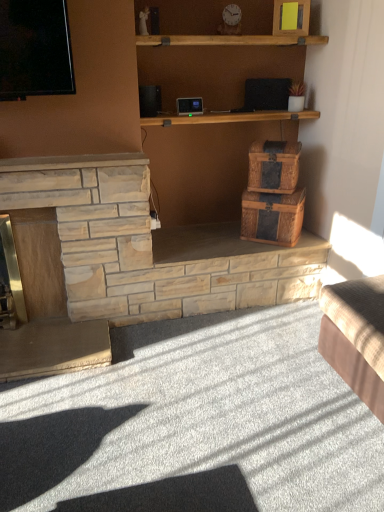
Question: Is woven wood chest at center outside natural stone fireplace at left?

Choices:
 (A) yes
 (B) no

Answer: (A)

Question: Considering the relative sizes of woven wood chest at center and natural stone fireplace at left in the image provided, is woven wood chest at center thinner than natural stone fireplace at left?

Choices:
 (A) yes
 (B) no

Answer: (B)

Question: Can you confirm if woven wood chest at center is wider than natural stone fireplace at left?

Choices:
 (A) no
 (B) yes

Answer: (B)

Question: Can you confirm if woven wood chest at center is positioned to the right of natural stone fireplace at left?

Choices:
 (A) no
 (B) yes

Answer: (B)

Question: Is woven wood chest at center closer to the viewer compared to natural stone fireplace at left?

Choices:
 (A) yes
 (B) no

Answer: (B)

Question: Is the depth of woven wood chest at center greater than that of natural stone fireplace at left?

Choices:
 (A) yes
 (B) no

Answer: (A)

Question: Considering the relative sizes of beige fabric couch at lower right and natural stone fireplace at left in the image provided, is beige fabric couch at lower right taller than natural stone fireplace at left?

Choices:
 (A) yes
 (B) no

Answer: (B)

Question: Is the depth of beige fabric couch at lower right less than that of natural stone fireplace at left?

Choices:
 (A) no
 (B) yes

Answer: (B)

Question: Can you confirm if beige fabric couch at lower right is bigger than natural stone fireplace at left?

Choices:
 (A) yes
 (B) no

Answer: (B)

Question: Is beige fabric couch at lower right in contact with natural stone fireplace at left?

Choices:
 (A) yes
 (B) no

Answer: (B)

Question: Is natural stone fireplace at left located within beige fabric couch at lower right?

Choices:
 (A) yes
 (B) no

Answer: (B)

Question: From a real-world perspective, is beige fabric couch at lower right on natural stone fireplace at left?

Choices:
 (A) no
 (B) yes

Answer: (A)

Question: Considering the relative sizes of woven brown crate at center-right and natural stone fireplace at left in the image provided, is woven brown crate at center-right smaller than natural stone fireplace at left?

Choices:
 (A) no
 (B) yes

Answer: (B)